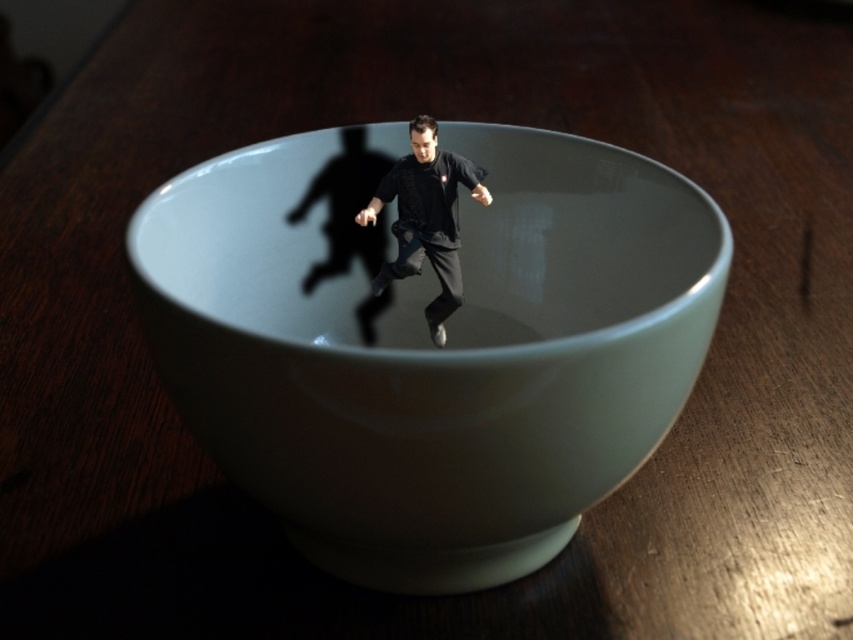
You are an artist setting up a still life. You have a white glossy bowl at center and a black matte shirt at center. Based on the scene, which object is closer to the light source?

The white glossy bowl at center is positioned under the black matte shirt at center, meaning the shirt is above the bowl. Since the shirt is above the bowl, it is closer to the light source.

You are an art curator examining the image. You need to determine the spatial relationship between the white glossy bowl at center and the black matte shirt at center. Which object is positioned closer to the viewer?

The white glossy bowl at center is closer to the viewer than the black matte shirt at center.